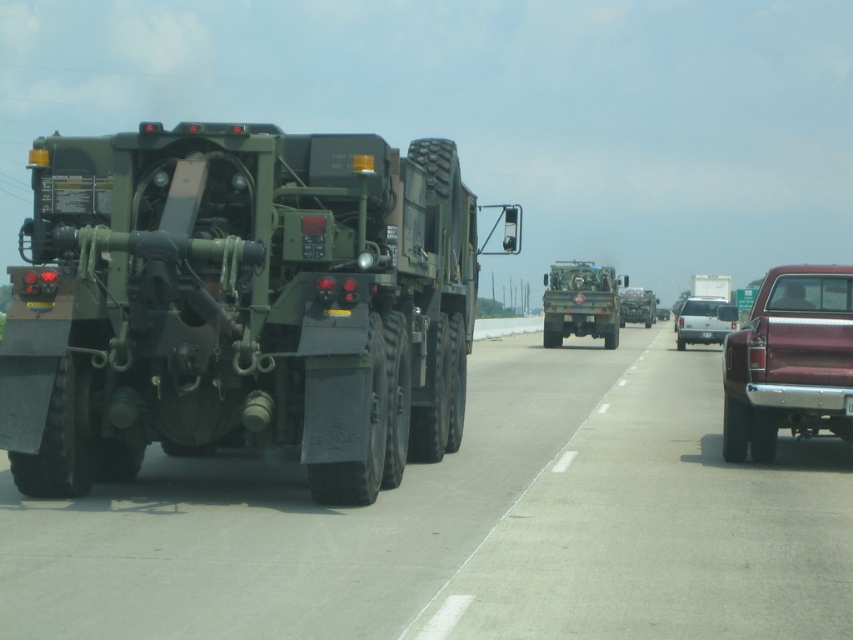
You are a driver in the maroon metallic truck at right. You want to overtake the matte green military vehicle at left. Is it possible to pass safely given their current positions?

The matte green military vehicle at left is in front of the maroon metallic truck at right, so the maroon metallic truck at right is behind it. To overtake safely, the driver would need to ensure there is enough space and that it is legally allowed in this convoy scenario. However, since they are part of a convoy, overtaking might not be permitted or safe.

You are a photographer planning to capture the matte green truck at center and the white matte van at center in a single frame. Considering their sizes, which vehicle will appear larger in the photo?

The matte green truck at center will appear larger in the photo since it is bigger than the white matte van at center according to the description.